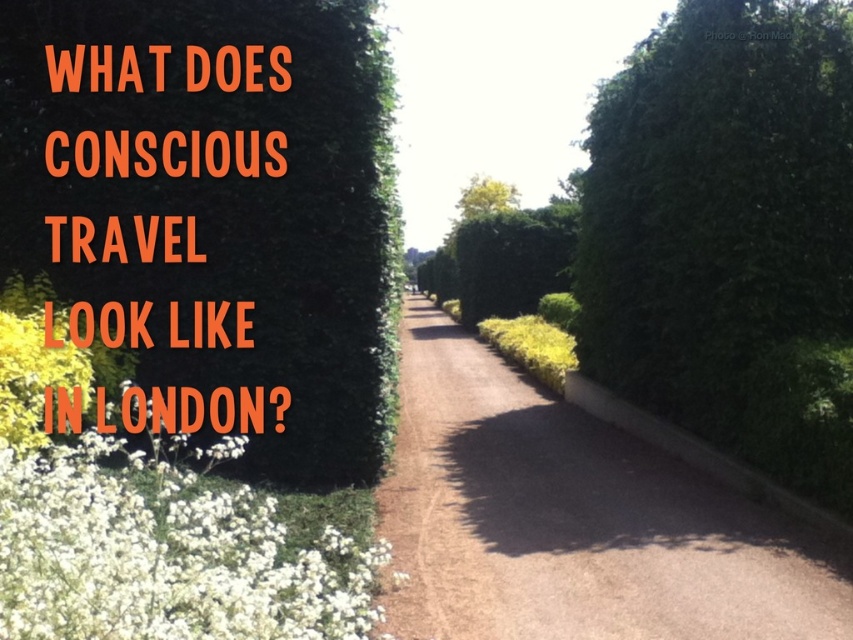
Between white fluffy petals at lower left and green leafy tree at center, which one is positioned lower?

white fluffy petals at lower left is lower down.

The width and height of the screenshot is (853, 640). Describe the element at coordinates (164, 556) in the screenshot. I see `white fluffy petals at lower left` at that location.

Between point (125, 492) and point (473, 205), which one is positioned behind?

Point (473, 205)

Where is `white fluffy petals at lower left`? This screenshot has height=640, width=853. white fluffy petals at lower left is located at coordinates (164, 556).

Is green leafy hedge at upper left thinner than green leafy tree at center?

Indeed, green leafy hedge at upper left has a lesser width compared to green leafy tree at center.

The width and height of the screenshot is (853, 640). In order to click on green leafy hedge at upper left in this screenshot , I will do `click(215, 211)`.

Is green leafy hedge at upper left shorter than white fluffy petals at lower left?

Incorrect, green leafy hedge at upper left's height does not fall short of white fluffy petals at lower left's.

Describe the element at coordinates (215, 211) in the screenshot. The height and width of the screenshot is (640, 853). I see `green leafy hedge at upper left` at that location.

Who is more distant from viewer, (105,88) or (138,547)?

The point (105,88) is behind.

Identify the location of green leafy hedge at upper left. (215, 211).